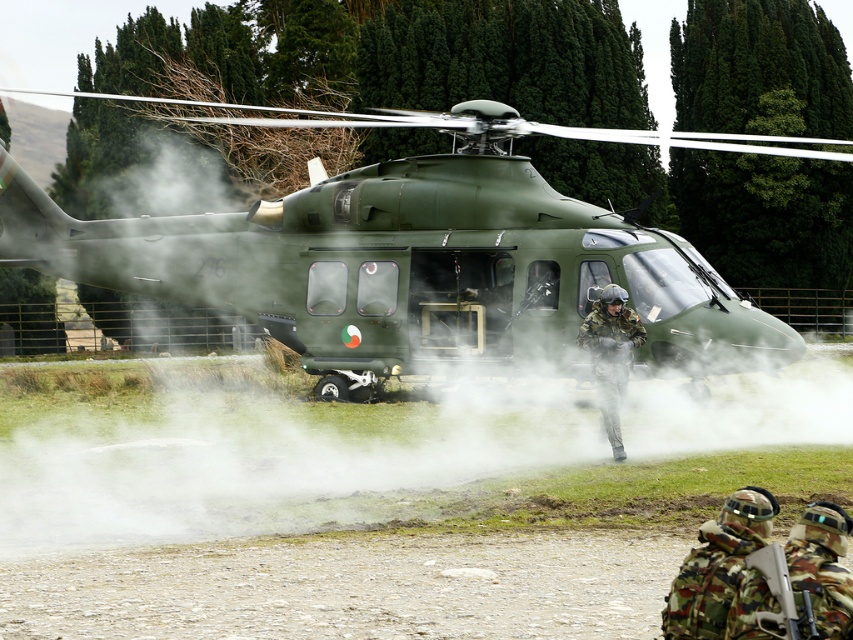
You are a drone operator trying to capture a clear photo of the matte green helicopter at center and the camouflage fabric helmet at center from above. The minimum distance between the drone and the objects must be 30 feet to avoid interference. Can the drone safely capture both objects in one shot without violating the safety distance?

The distance between the matte green helicopter at center and the camouflage fabric helmet at center is 28.28 feet, which is less than the required 30 feet. Therefore, the drone cannot safely capture both objects in one shot without violating the safety distance.

You are a drone operator controlling a drone flying above the military helicopter scene. You need to determine the distance between two points to ensure safe navigation. Which point, point 1 at coordinates (x=688, y=134) or point 2 at coordinates (x=625, y=378), is closer to your drone camera?

Point 2 at coordinates (x=625, y=378) is closer to the drone camera because it is nearer than point 1 at coordinates (x=688, y=134).